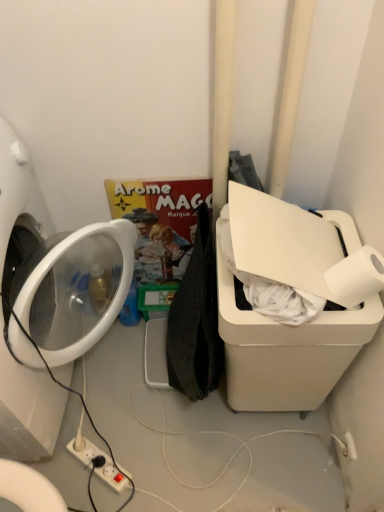
Question: Based on their sizes in the image, would you say white glossy washing machine at left is bigger or smaller than white plastic power strip at lower center?

Choices:
 (A) big
 (B) small

Answer: (A)

Question: From the image's perspective, is white glossy washing machine at left located above or below white plastic power strip at lower center?

Choices:
 (A) above
 (B) below

Answer: (A)

Question: Which object is the closest to the white plastic power strip at lower center?

Choices:
 (A) white plastic water cooler at right
 (B) white glossy washing machine at left
 (C) white matte toilet paper at upper right
 (D) matte cardboard comic book at center

Answer: (B)

Question: Which object is positioned closest to the white plastic power strip at lower center?

Choices:
 (A) matte cardboard comic book at center
 (B) white glossy washing machine at left
 (C) white matte toilet paper at upper right
 (D) white plastic water cooler at right

Answer: (B)